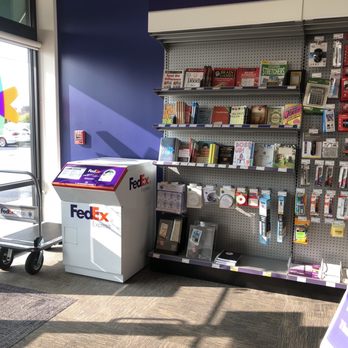
The image size is (348, 348). In order to click on fire alarm in this screenshot , I will do `click(81, 138)`.